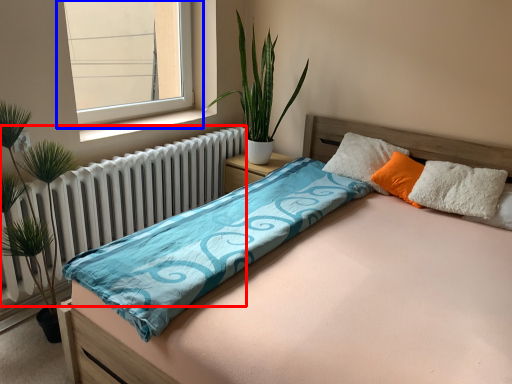
Question: Which point is closer to the camera, radiator (highlighted by a red box) or window (highlighted by a blue box)?

Choices:
 (A) radiator
 (B) window

Answer: (A)